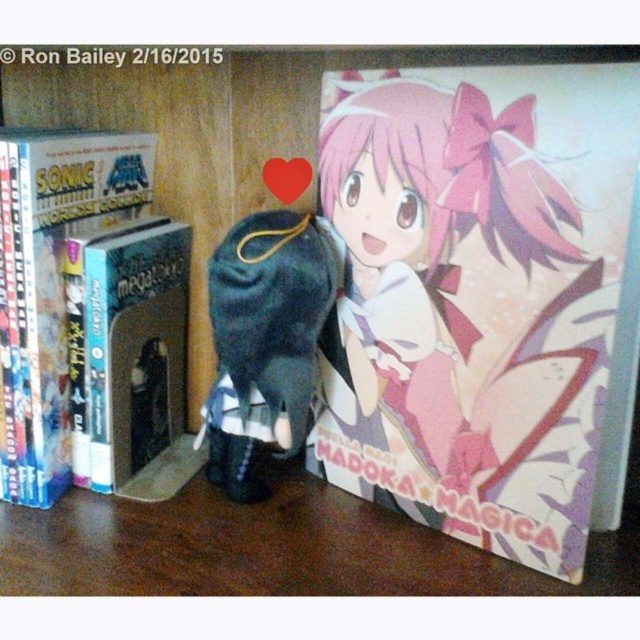
Is the position of pink matte book at center more distant than that of velvet plush toy at center?

That is False.

Is point (394, 173) closer to viewer compared to point (285, 298)?

No, (394, 173) is behind (285, 298).

Does point (477, 500) come closer to viewer compared to point (218, 333)?

Yes, point (477, 500) is closer to viewer.

I want to click on pink matte book at center, so click(x=476, y=296).

Can you confirm if brown wooden table at center is smaller than hardcover book at center?

No.

Who is higher up, brown wooden table at center or hardcover book at center?

Positioned higher is hardcover book at center.

Image resolution: width=640 pixels, height=640 pixels. What are the coordinates of `brown wooden table at center` in the screenshot? It's located at (269, 548).

Does pink matte book at center appear on the right side of hardcover book at center?

Indeed, pink matte book at center is positioned on the right side of hardcover book at center.

Between pink matte book at center and hardcover book at center, which one appears on the right side from the viewer's perspective?

pink matte book at center is more to the right.

Where is `pink matte book at center`? The image size is (640, 640). pink matte book at center is located at coordinates (476, 296).